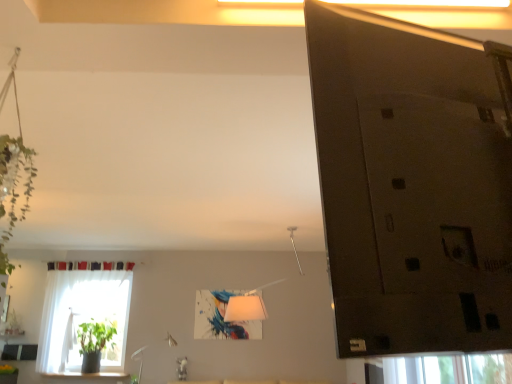
This screenshot has height=384, width=512. Describe the element at coordinates (84, 319) in the screenshot. I see `white sheer curtain at left` at that location.

Locate an element on the screen. This screenshot has height=384, width=512. white sheer curtain at left is located at coordinates (84, 319).

In order to face white sheer curtain at left, should I rotate leftwards or rightwards?

Rotate left and turn 21.894 degrees.

What do you see at coordinates (94, 343) in the screenshot? I see `green matte plant at lower left` at bounding box center [94, 343].

You are a GUI agent. You are given a task and a screenshot of the screen. Output one action in this format:
    pyautogui.click(x=<x>, y=<y>)
    Task: Click on the green matte plant at lower left
    
    Given the screenshot: What is the action you would take?
    pyautogui.click(x=94, y=343)

Identify the location of white sheer curtain at left. The width and height of the screenshot is (512, 384). (84, 319).

Considering the positions of objects green matte plant at lower left and white sheer curtain at left in the image provided, who is more to the left, green matte plant at lower left or white sheer curtain at left?

Positioned to the left is white sheer curtain at left.

Between green matte plant at lower left and white sheer curtain at left, which one is positioned behind?

green matte plant at lower left is further away from the camera.

Is point (98, 339) farther from viewer compared to point (124, 290)?

No, it is not.

From the image's perspective, does green matte plant at lower left appear higher than white sheer curtain at left?

No, from the image's perspective, green matte plant at lower left is not on top of white sheer curtain at left.

From a real-world perspective, does green matte plant at lower left stand above white sheer curtain at left?

No, from a real-world perspective, green matte plant at lower left is not on top of white sheer curtain at left.

Does green matte plant at lower left have a greater width compared to white sheer curtain at left?

Correct, the width of green matte plant at lower left exceeds that of white sheer curtain at left.

Considering the relative sizes of green matte plant at lower left and white sheer curtain at left in the image provided, is green matte plant at lower left taller than white sheer curtain at left?

Incorrect, the height of green matte plant at lower left is not larger of that of white sheer curtain at left.

Based on the photo, based on their sizes in the image, would you say green matte plant at lower left is bigger or smaller than white sheer curtain at left?

In the image, green matte plant at lower left appears to be smaller than white sheer curtain at left.

Is green matte plant at lower left inside the boundaries of white sheer curtain at left, or outside?

green matte plant at lower left is inside white sheer curtain at left.

Is green matte plant at lower left next to white sheer curtain at left?

No, green matte plant at lower left is not touching white sheer curtain at left.

Is green matte plant at lower left facing towards white sheer curtain at left?

Yes, green matte plant at lower left faces towards white sheer curtain at left.

Find the location of a particular element. houseplant on the right of the white sheer curtain at left is located at coordinates (94, 343).

Which is more to the right, white sheer curtain at left or green matte plant at lower left?

From the viewer's perspective, green matte plant at lower left appears more on the right side.

Which object is further away from the camera taking this photo, white sheer curtain at left or green matte plant at lower left?

green matte plant at lower left is more distant.

Based on the photo, which is nearer, (82, 295) or (95, 345)?

Point (82, 295) appears to be farther away from the viewer than point (95, 345).

From the image's perspective, which is below, white sheer curtain at left or green matte plant at lower left?

green matte plant at lower left is shown below in the image.

From a real-world perspective, is white sheer curtain at left under green matte plant at lower left?

No, from a real-world perspective, white sheer curtain at left is not under green matte plant at lower left.

Which of these two, white sheer curtain at left or green matte plant at lower left, is thinner?

white sheer curtain at left.

Who is taller, white sheer curtain at left or green matte plant at lower left?

white sheer curtain at left.

Is white sheer curtain at left bigger or smaller than green matte plant at lower left?

Result: In the image, white sheer curtain at left appears to be larger than green matte plant at lower left.

Is white sheer curtain at left spatially inside green matte plant at lower left, or outside of it?

The correct answer is: outside.

Is white sheer curtain at left placed right next to green matte plant at lower left?

white sheer curtain at left and green matte plant at lower left are clearly separated.

Is green matte plant at lower left at the back of white sheer curtain at left?

Yes, green matte plant at lower left is at the back of white sheer curtain at left.

How different are the orientations of white sheer curtain at left and green matte plant at lower left in degrees?

white sheer curtain at left and green matte plant at lower left are facing 1.01 degrees away from each other.

Find the location of a particular element. This screenshot has height=384, width=512. houseplant behind the white sheer curtain at left is located at coordinates (94, 343).

You are a GUI agent. You are given a task and a screenshot of the screen. Output one action in this format:
    pyautogui.click(x=<x>, y=<y>)
    Task: Click on the houseplant beneath the white sheer curtain at left (from a real-world perspective)
    This screenshot has width=512, height=384.
    Given the screenshot: What is the action you would take?
    pyautogui.click(x=94, y=343)

The width and height of the screenshot is (512, 384). Find the location of `window above the green matte plant at lower left (from a real-world perspective)`. window above the green matte plant at lower left (from a real-world perspective) is located at coordinates (84, 319).